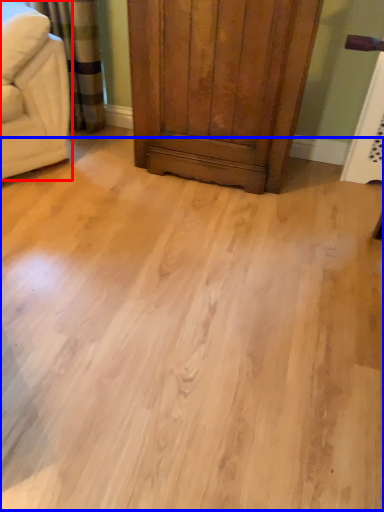
Question: Among these objects, which one is nearest to the camera, furniture (highlighted by a red box) or plain (highlighted by a blue box)?

Choices:
 (A) furniture
 (B) plain

Answer: (B)